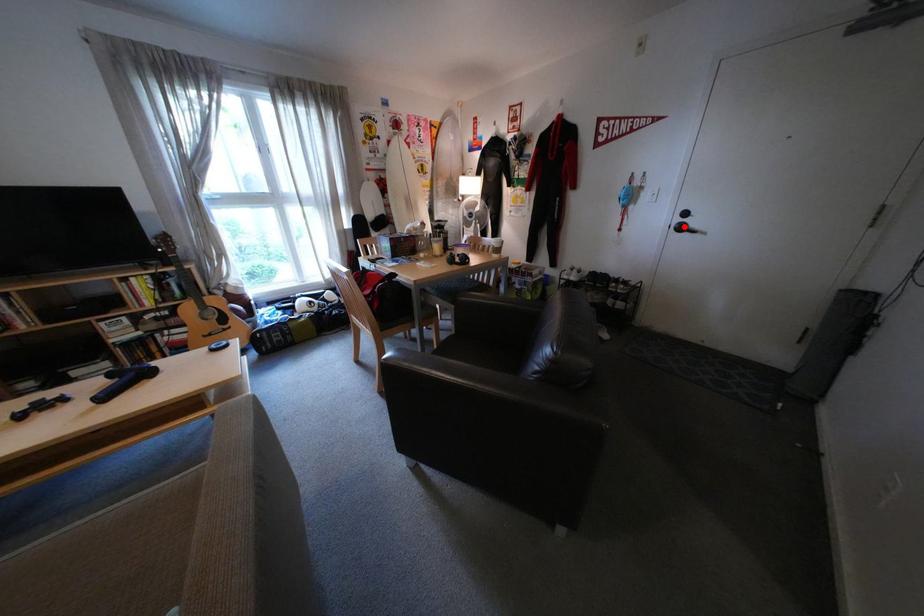
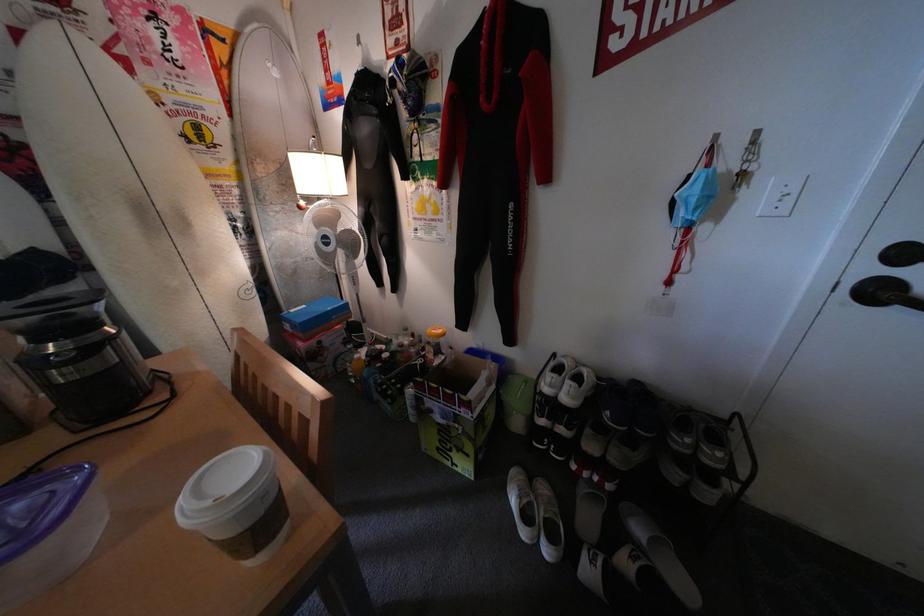
The point at the highlighted location is marked in the first image. Where is the corresponding point in the second image?

(853, 284)